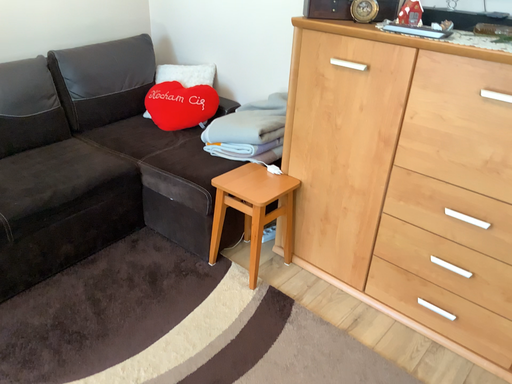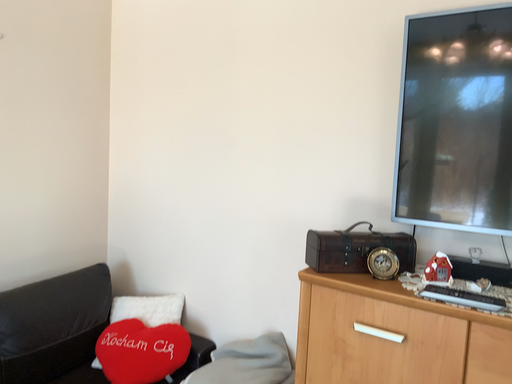
Question: Which way did the camera rotate in the video?

Choices:
 (A) rotated upward
 (B) rotated downward

Answer: (A)